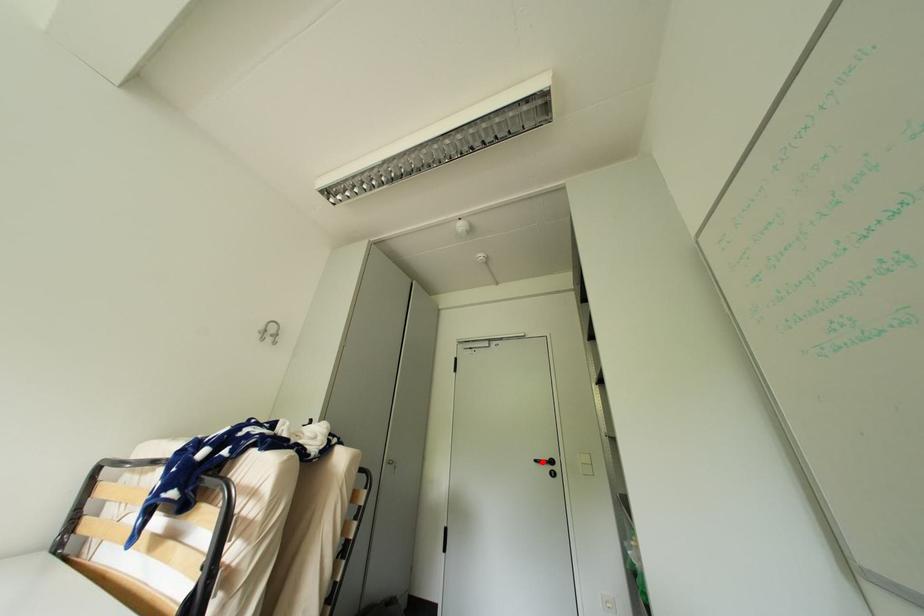
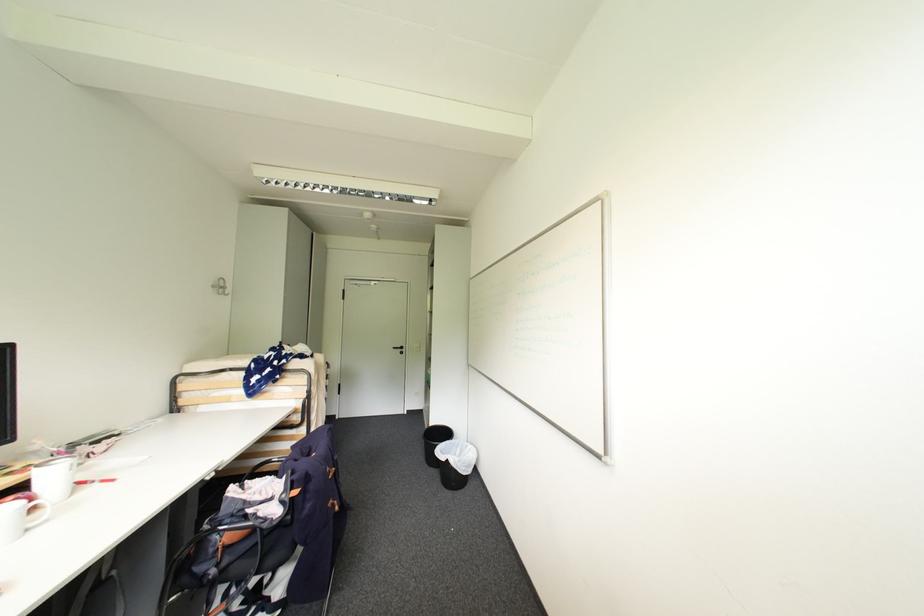
Question: I am providing you with two images of the same scene from different viewpoints. Given a red point in image1, look at the same physical point in image2. Is it:

Choices:
 (A) Closer to the viewpoint
 (B) Farther from the viewpoint

Answer: (B)